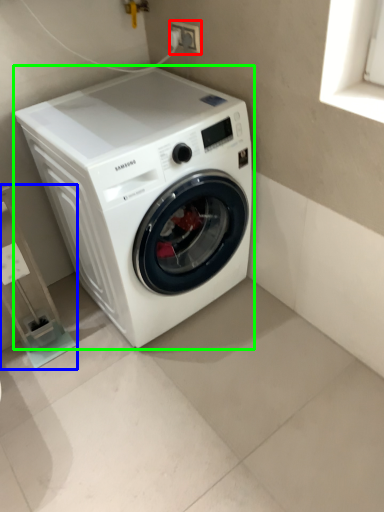
Question: Which is farther away from electric outlet (highlighted by a red box)? shelf (highlighted by a blue box) or washing machine (highlighted by a green box)?

Choices:
 (A) shelf
 (B) washing machine

Answer: (A)